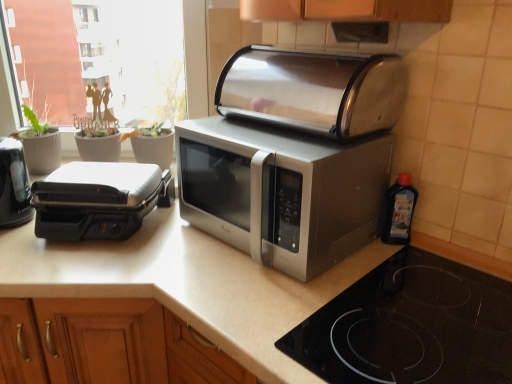
Locate an element on the screen. The width and height of the screenshot is (512, 384). free location in front of black plastic toaster at left, which appears as the 2th toaster when viewed from the right is located at coordinates (78, 265).